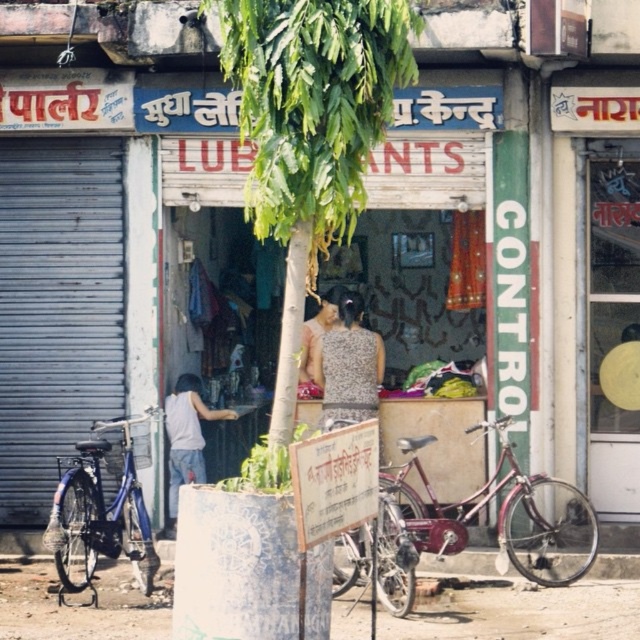
Can you confirm if maroon metallic bicycle at lower right is positioned above speckled fabric dress at center?

Actually, maroon metallic bicycle at lower right is below speckled fabric dress at center.

Locate an element on the screen. maroon metallic bicycle at lower right is located at coordinates (500, 515).

This screenshot has height=640, width=640. I want to click on maroon metallic bicycle at lower right, so click(x=500, y=515).

Is speckled fabric dress at center in front of shiny metallic bicycle at center?

That is False.

Which is below, speckled fabric dress at center or shiny metallic bicycle at center?

shiny metallic bicycle at center

This screenshot has width=640, height=640. What are the coordinates of `speckled fabric dress at center` in the screenshot? It's located at (348, 364).

Does green leafy tree at center have a greater height compared to blue metallic bicycle at left?

Correct, green leafy tree at center is much taller as blue metallic bicycle at left.

Which is above, green leafy tree at center or blue metallic bicycle at left?

Positioned higher is green leafy tree at center.

The height and width of the screenshot is (640, 640). Identify the location of green leafy tree at center. 310,131.

This screenshot has height=640, width=640. What are the coordinates of `green leafy tree at center` in the screenshot? It's located at (310, 131).